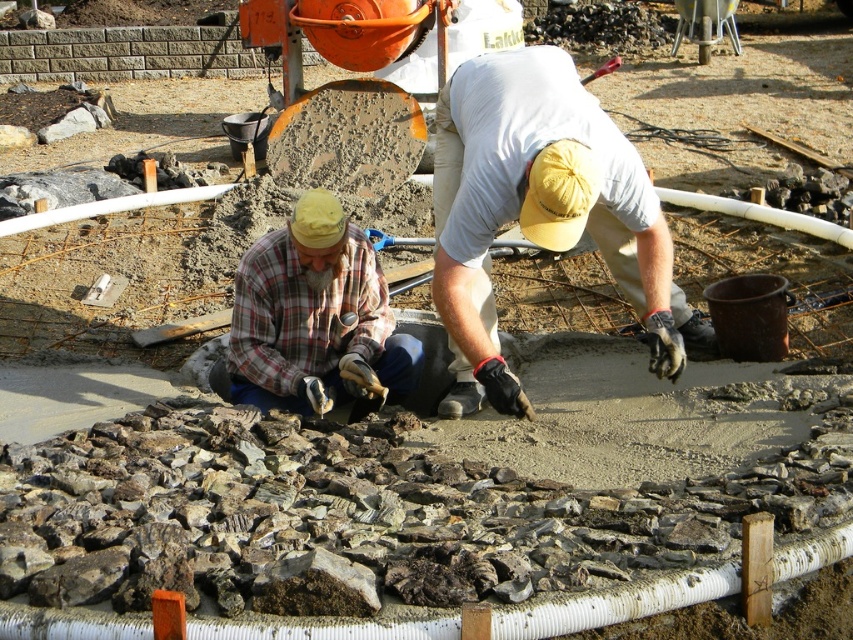
You are standing at the center of the construction site and notice a light blue cotton shirt at center. Can you determine its exact position relative to the white pipe running along the bottom edge of the frame?

The light blue cotton shirt at center is located at point [538,209], which is above the white pipe at the bottom edge of the frame.

You are a safety inspector observing the construction site. You notice two workers wearing shirts labeled as the light blue cotton shirt at center and plaid fabric shirt at center. According to the safety protocol, workers must stand at least 1.5 meters away from the white pipe at the bottom edge to avoid tripping. Can you determine if either worker is too close to the pipe based on their height?

Answer: The light blue cotton shirt at center is much taller than plaid fabric shirt at center, but their proximity to the white pipe at the bottom edge cannot be determined by height alone. The description does not provide information about their distance from the pipe.

You are a safety inspector observing the construction site. You notice two workers wearing shirts labeled as the light blue cotton shirt at center and the plaid fabric shirt at center. According to safety protocols, workers must wear high visibility clothing. Which worker is closer to you, and thus more likely to be in compliance with visibility requirements?

The light blue cotton shirt at center is in front of the plaid fabric shirt at center, so the worker wearing the light blue cotton shirt at center is closer to you and more likely to be in compliance with visibility requirements.